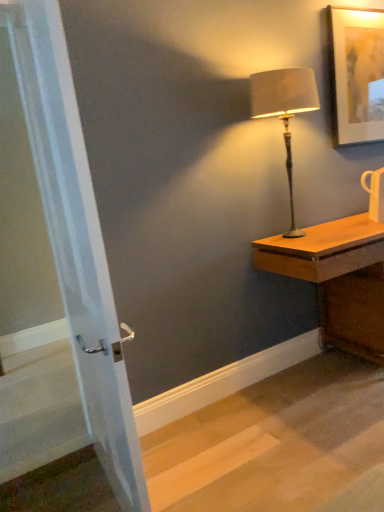
At what (x,y) coordinates should I click in order to perform the action: click on free spot below satin beige lampshade at right (from a real-world perspective). Please return your answer as a coordinate pair (x, y). The image size is (384, 512). Looking at the image, I should click on (293, 237).